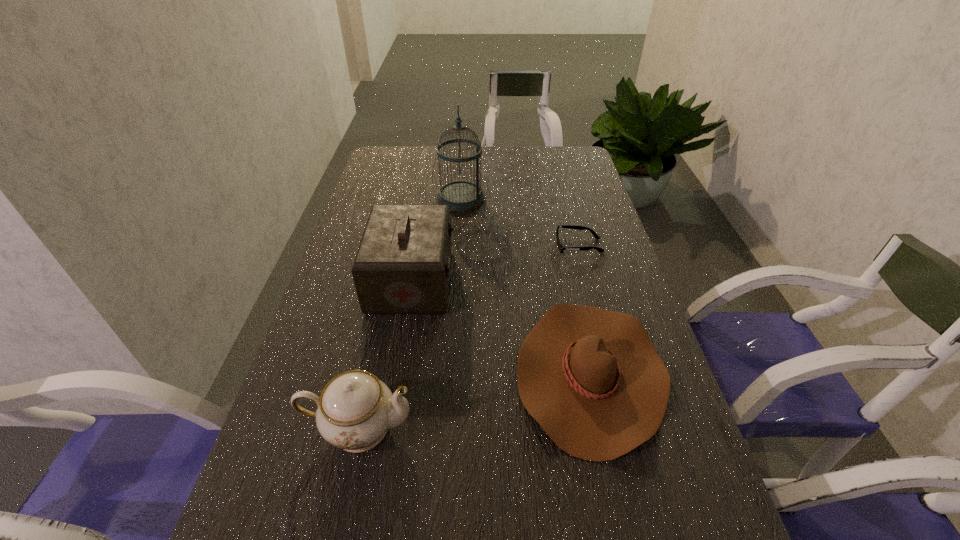
You are a GUI agent. You are given a task and a screenshot of the screen. Output one action in this format:
    pyautogui.click(x=<x>, y=<y>)
    Task: Click on the vacant point that satisfies the following two spatial constraints: 1. on the front-facing side of the birdcage; 2. on the front side of the fourth shortest object
    
    Given the screenshot: What is the action you would take?
    pyautogui.click(x=456, y=280)

The image size is (960, 540). Identify the location of free location that satisfies the following two spatial constraints: 1. on the front-facing side of the birdcage; 2. on the right side of the fourth tallest object. (450, 372).